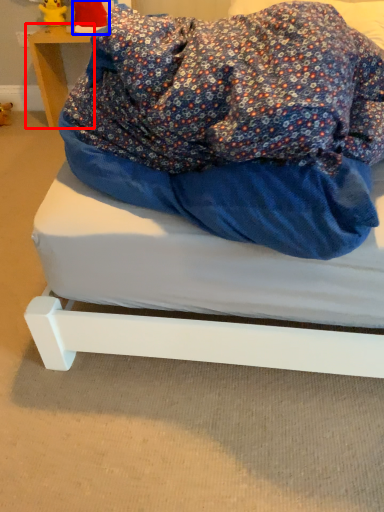
Question: Which object appears farthest to the camera in this image, furniture (highlighted by a red box) or toy (highlighted by a blue box)?

Choices:
 (A) furniture
 (B) toy

Answer: (A)